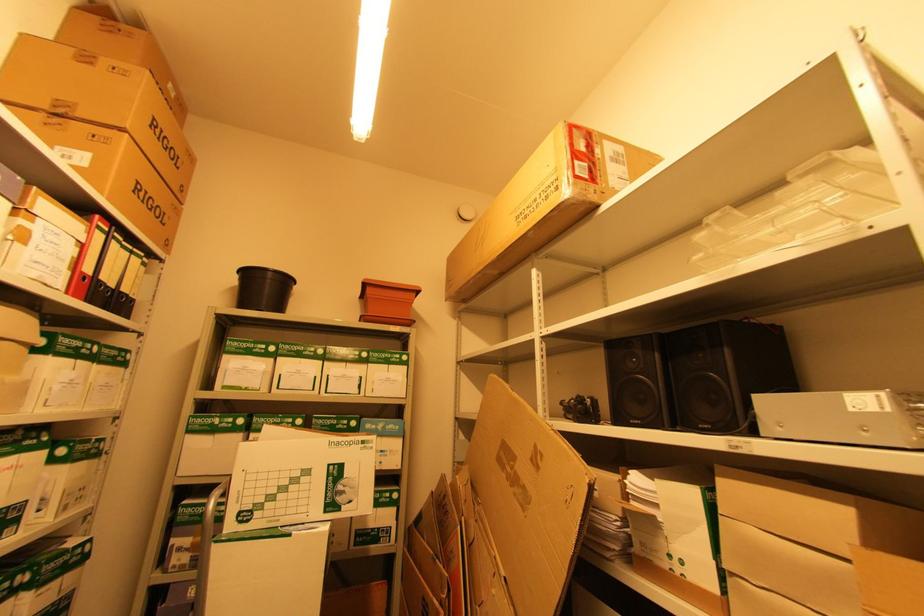
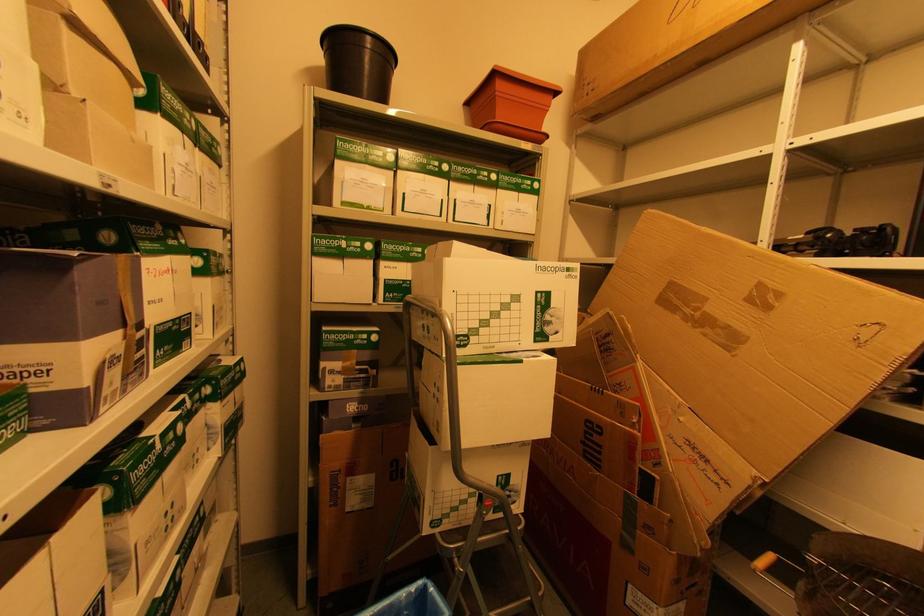
Question: The images are taken continuously from a first-person perspective. In which direction is your viewpoint rotating?

Choices:
 (A) Left
 (B) Right
 (C) Up
 (D) Down

Answer: (D)